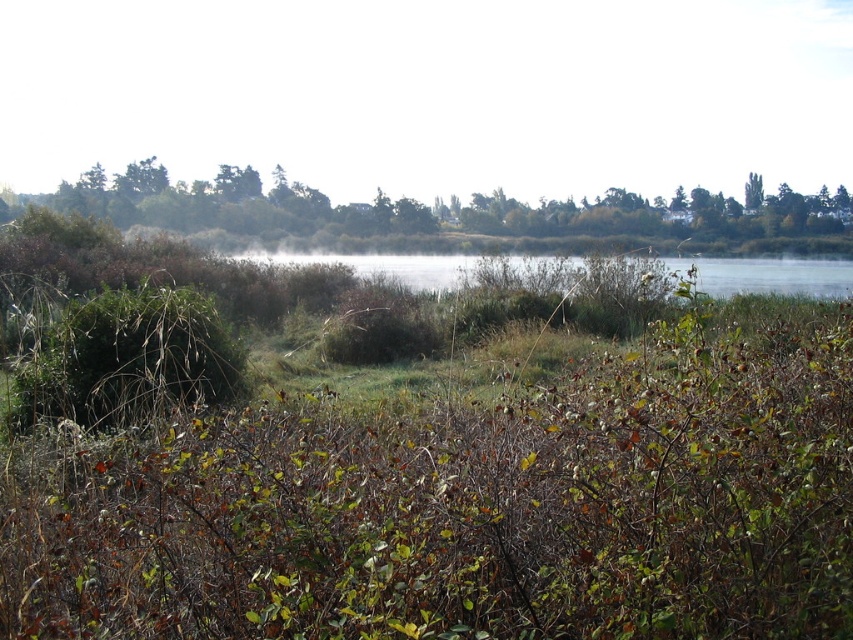
Question: Does foggy mist at upper center have a larger size compared to green leafy tree at upper right?

Choices:
 (A) yes
 (B) no

Answer: (A)

Question: Does foggy mist at upper center have a larger size compared to green leafy tree at upper right?

Choices:
 (A) yes
 (B) no

Answer: (A)

Question: Which point is farther to the camera?

Choices:
 (A) (830, 579)
 (B) (332, 141)

Answer: (B)

Question: Is green leafy trees at upper center wider than clear water at center?

Choices:
 (A) no
 (B) yes

Answer: (B)

Question: Which of the following is the closest to the observer?

Choices:
 (A) green leafy tree at upper right
 (B) clear water at center

Answer: (B)

Question: Which of the following is the farthest from the observer?

Choices:
 (A) foggy mist at upper center
 (B) green leafy trees at upper center
 (C) green leafy tree at upper right
 (D) brown dry grass at center

Answer: (A)